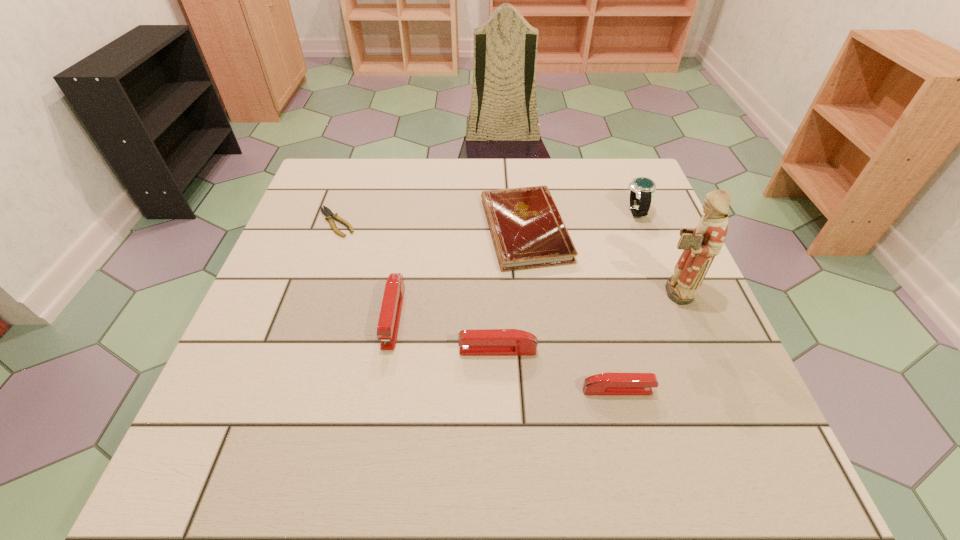
Identify the location of object at the far right corner. (642, 189).

Identify the location of object positioned at the near right corner. The width and height of the screenshot is (960, 540). (607, 383).

The image size is (960, 540). Identify the location of free space at the far edge of the desktop. (413, 178).

The width and height of the screenshot is (960, 540). In the image, there is a desktop. Identify the location of vacant space at the near edge. (416, 404).

Where is `vacant area at the left edge`? The height and width of the screenshot is (540, 960). vacant area at the left edge is located at coordinates (285, 293).

Locate an element on the screen. The height and width of the screenshot is (540, 960). free location at the right edge of the desktop is located at coordinates (645, 364).

In the image, there is a desktop. Identify the location of free space at the far left corner. (364, 169).

The height and width of the screenshot is (540, 960). In the image, there is a desktop. Identify the location of vacant space at the near left corner. (268, 410).

This screenshot has height=540, width=960. Identify the location of vacant position at the far right corner of the desktop. (593, 186).

Image resolution: width=960 pixels, height=540 pixels. I want to click on free point at the near right corner, so click(741, 398).